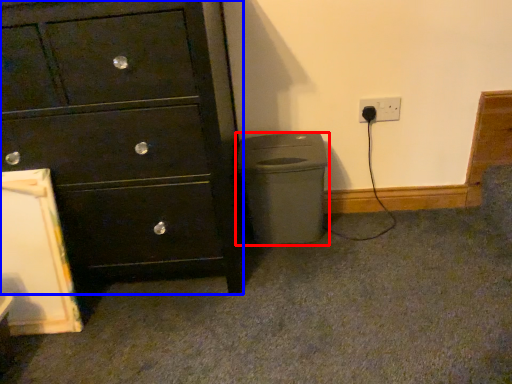
Question: Which point is further to the camera, waste container (highlighted by a red box) or chest of drawers (highlighted by a blue box)?

Choices:
 (A) waste container
 (B) chest of drawers

Answer: (A)